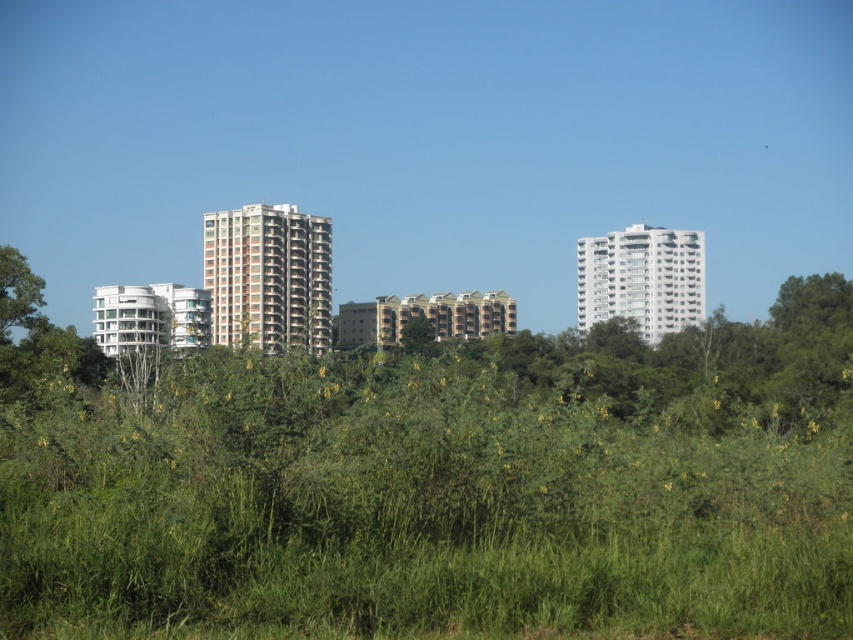
Which is below, orange brick building at center or green leafy tree at center?

Positioned lower is green leafy tree at center.

The height and width of the screenshot is (640, 853). Find the location of `orange brick building at center`. orange brick building at center is located at coordinates (268, 276).

Find the location of a particular element. The image size is (853, 640). orange brick building at center is located at coordinates (268, 276).

Between point (653, 342) and point (415, 339), which one is positioned behind?

The point (653, 342) is more distant.

This screenshot has height=640, width=853. Find the location of `white glossy building at upper right`. white glossy building at upper right is located at coordinates (642, 280).

Does orange brick building at center have a larger size compared to green leafy tree at left?

Correct, orange brick building at center is larger in size than green leafy tree at left.

Who is positioned more to the left, orange brick building at center or green leafy tree at left?

Positioned to the left is green leafy tree at left.

Locate an element on the screen. orange brick building at center is located at coordinates (268, 276).